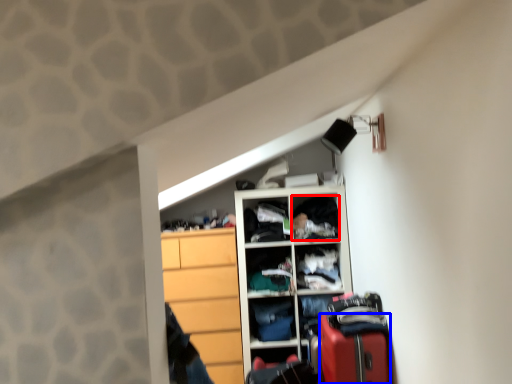
Question: Which object appears farthest to the camera in this image, clothing (highlighted by a red box) or luggage (highlighted by a blue box)?

Choices:
 (A) clothing
 (B) luggage

Answer: (A)